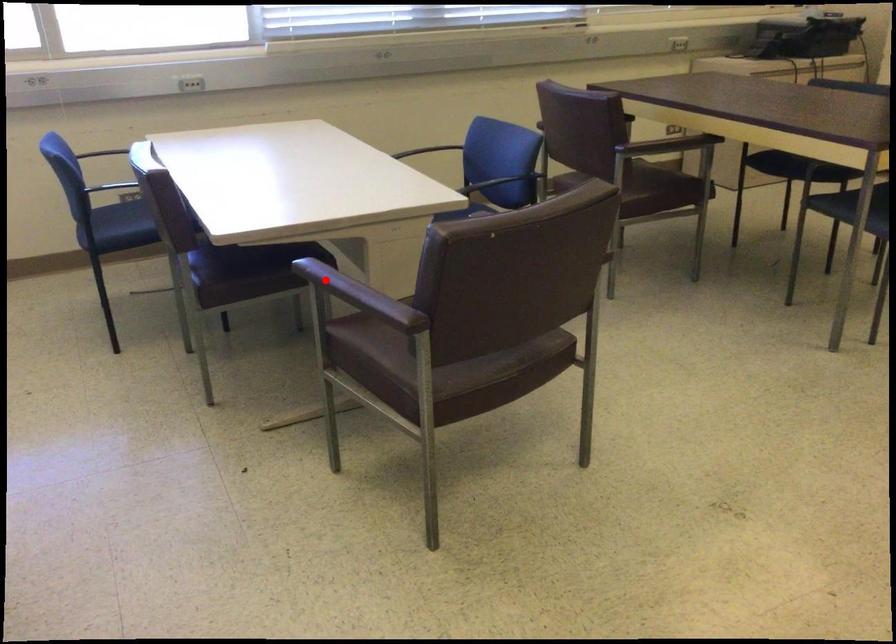
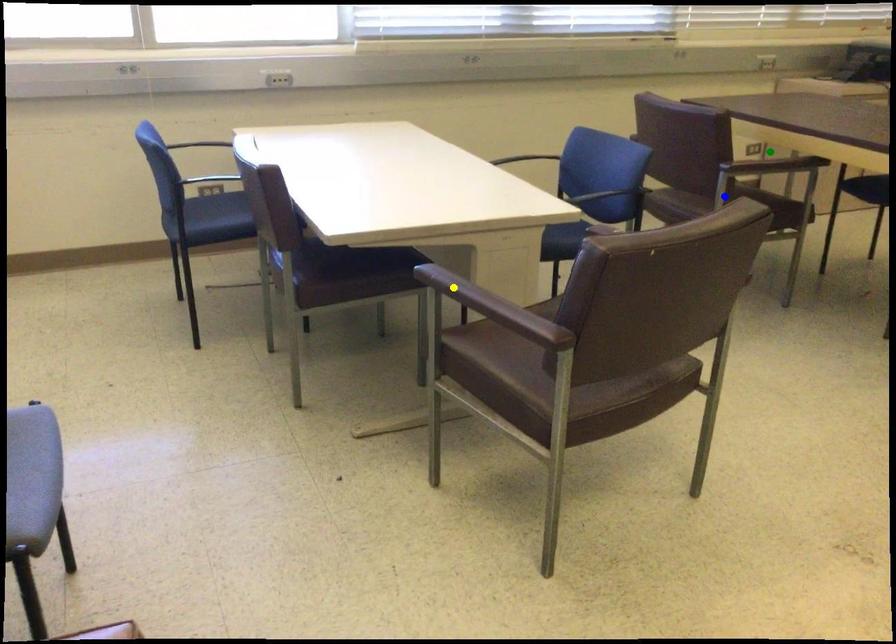
Question: I am providing you with two images of the same scene from different viewpoints. A red point is marked on the first image. You are given multiple points on the second image. Which point in image 2 represents the same 3d spot as the red point in image 1?

Choices:
 (A) green point
 (B) yellow point
 (C) blue point

Answer: (B)